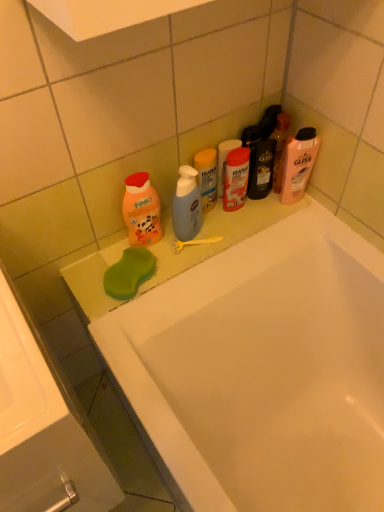
In order to click on vacant space to the right of orange matte baby soap at left, which is counted as the 3th cleaning product, starting from the right in this screenshot , I will do `click(202, 237)`.